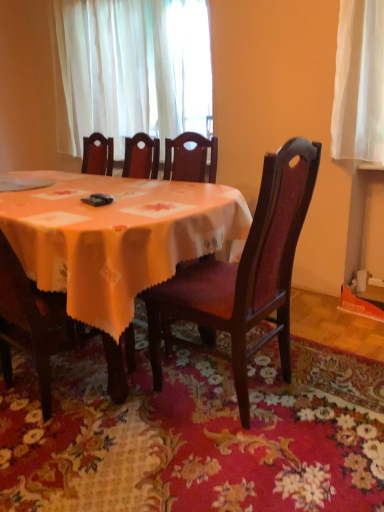
Where is `vacant space in front of matte wood chair at center, which appears as the second chair when viewed from the left`? vacant space in front of matte wood chair at center, which appears as the second chair when viewed from the left is located at coordinates (234, 469).